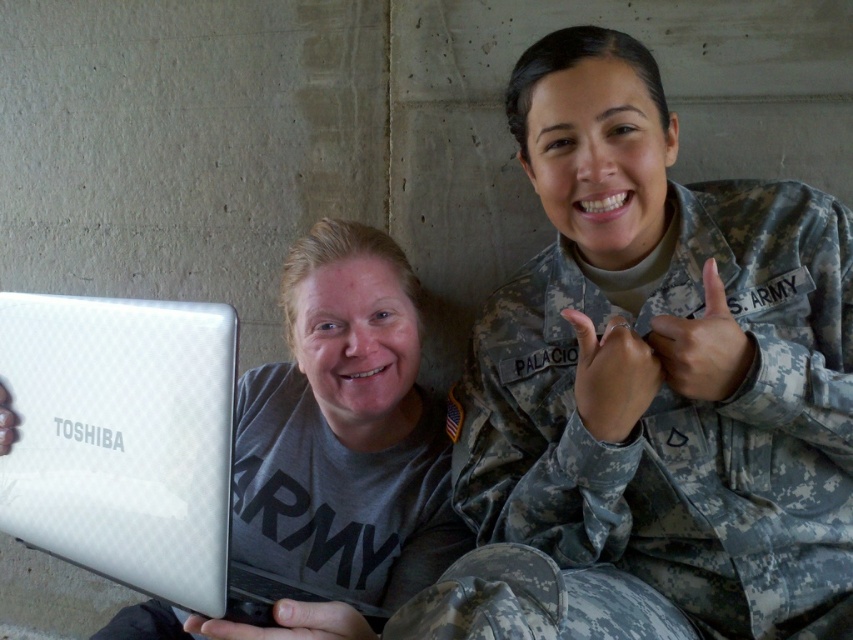
You are a photographer standing in front of the scene. You want to capture a closeup shot of the camouflage fabric us army uniform at upper right. Considering your current position, is the distance sufficient for a clear, detailed photo without needing to move closer?

The camouflage fabric us army uniform at upper right is 81.35 centimeters away from viewer. This distance is sufficient for a clear, detailed photo without needing to move closer.

You are a photographer planning to take a portrait of the two people in the image. You need to ensure that both the camouflage fabric us army uniform at upper right and the silver textured laptop at center are visible in the frame. Given their sizes, which object should you prioritize positioning closer to the camera to maintain clarity?

The camouflage fabric us army uniform at upper right is larger in size than the silver textured laptop at center, so you should prioritize positioning the camouflage fabric us army uniform at upper right closer to the camera to maintain clarity.